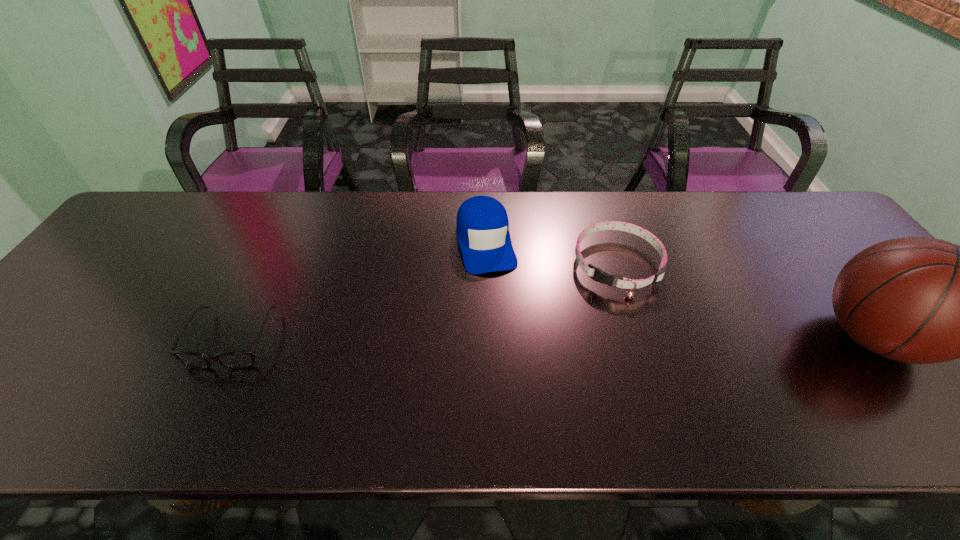
Locate an element on the screen. This screenshot has height=540, width=960. empty location between the baseball cap and the second object from right to left is located at coordinates (552, 254).

Locate an element on the screen. free space between the leftmost object and the dog collar is located at coordinates click(425, 303).

Find the location of a particular element. empty space between the third object from left to right and the third shortest object is located at coordinates (552, 254).

I want to click on blank region between the spectacles and the second tallest object, so click(x=360, y=291).

At what (x,y) coordinates should I click in order to perform the action: click on object that is the second closest to the spectacles. Please return your answer as a coordinate pair (x, y). Looking at the image, I should click on 600,276.

The width and height of the screenshot is (960, 540). I want to click on object that is the closest to the second tallest object, so click(600, 276).